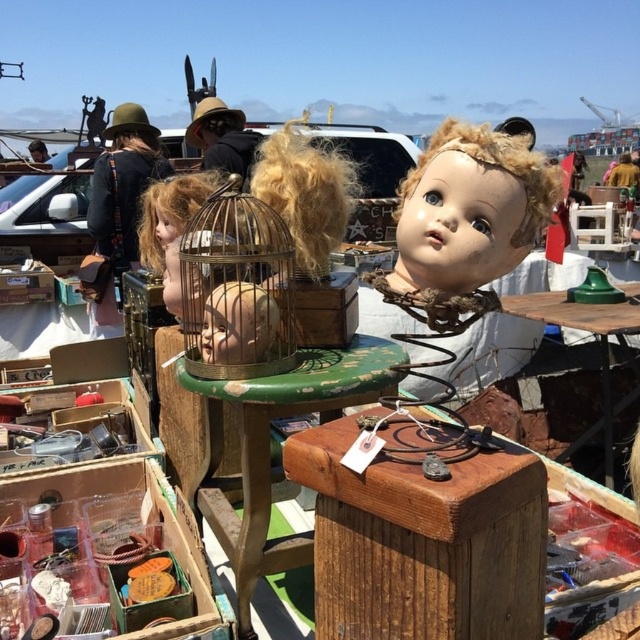
Question: Considering the real-world distances, which object is farthest from the gold wire birdcage at center?

Choices:
 (A) green painted wood table at center
 (B) wooden table at center
 (C) matte plastic doll head at upper right

Answer: (B)

Question: Does matte plastic doll head at upper right have a lesser width compared to green painted wood table at center?

Choices:
 (A) yes
 (B) no

Answer: (A)

Question: Which object is the farthest from the wooden table at center?

Choices:
 (A) green painted wood table at center
 (B) matte plastic doll head at upper right

Answer: (B)

Question: Is green painted wood table at center wider than gold wire birdcage at center?

Choices:
 (A) yes
 (B) no

Answer: (A)

Question: Considering the relative positions of matte plastic doll head at upper right and green painted wood table at center in the image provided, where is matte plastic doll head at upper right located with respect to green painted wood table at center?

Choices:
 (A) below
 (B) above

Answer: (B)

Question: Among these points, which one is nearest to the camera?

Choices:
 (A) (477, 205)
 (B) (205, 490)
 (C) (193, 269)

Answer: (A)